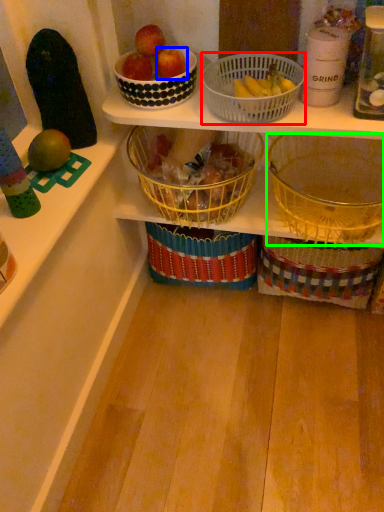
Question: Which is nearer to the basket (highlighted by a red box)? apple (highlighted by a blue box) or basket (highlighted by a green box).

Choices:
 (A) apple
 (B) basket

Answer: (A)